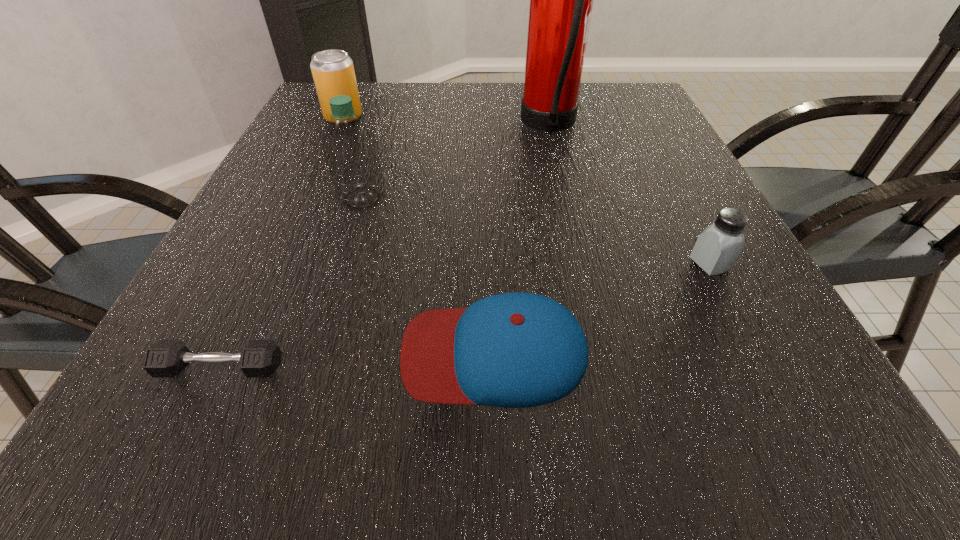
The width and height of the screenshot is (960, 540). In order to click on unoccupied area between the second tallest object and the tallest object in this screenshot , I will do `click(456, 162)`.

Where is `empty space that is in between the third farthest object and the tallest object`? empty space that is in between the third farthest object and the tallest object is located at coordinates (456, 162).

Locate an element on the screen. blank region between the fourth farthest object and the baseball cap is located at coordinates (602, 308).

Image resolution: width=960 pixels, height=540 pixels. Find the location of `free space that is in between the tallest object and the third tallest object`. free space that is in between the tallest object and the third tallest object is located at coordinates (446, 122).

Locate an element on the screen. This screenshot has width=960, height=540. vacant space that's between the dumbbell and the tallest object is located at coordinates (385, 247).

Where is `free point between the fourth shortest object and the dumbbell`? The height and width of the screenshot is (540, 960). free point between the fourth shortest object and the dumbbell is located at coordinates (282, 242).

Identify which object is the fifth nearest to the dumbbell. Please provide its 2D coordinates. Your answer should be formatted as a tuple, i.e. [(x, y)], where the tuple contains the x and y coordinates of a point satisfying the conditions above.

[(333, 72)]

Locate which object is the third closest to the second tallest object. Please provide its 2D coordinates. Your answer should be formatted as a tuple, i.e. [(x, y)], where the tuple contains the x and y coordinates of a point satisfying the conditions above.

[(561, 0)]

In order to click on vacant space that satisfies the following two spatial constraints: 1. on the back side of the third farthest object; 2. on the left side of the fire extinguisher in this screenshot , I will do `click(385, 126)`.

At what (x,y) coordinates should I click in order to perform the action: click on free space that satisfies the following two spatial constraints: 1. on the back side of the shortest object; 2. on the right side of the third farthest object. Please return your answer as a coordinate pair (x, y). The image size is (960, 540). Looking at the image, I should click on (301, 198).